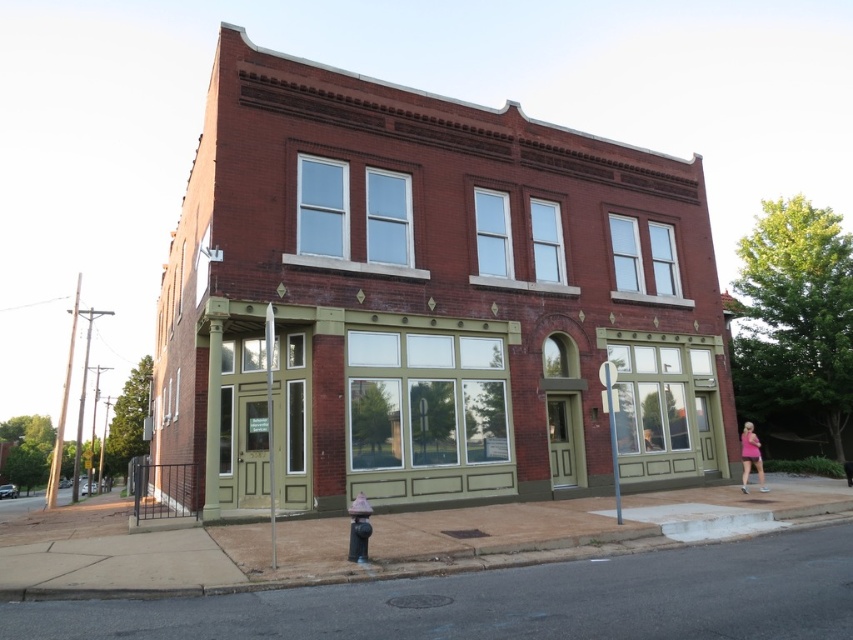
Question: Can you confirm if brick building at center is thinner than pink fabric dress at lower right?

Choices:
 (A) no
 (B) yes

Answer: (A)

Question: Is brick building at center to the left of pink fabric dress at lower right from the viewer's perspective?

Choices:
 (A) yes
 (B) no

Answer: (A)

Question: Does brick building at center have a greater width compared to pink fabric dress at lower right?

Choices:
 (A) yes
 (B) no

Answer: (A)